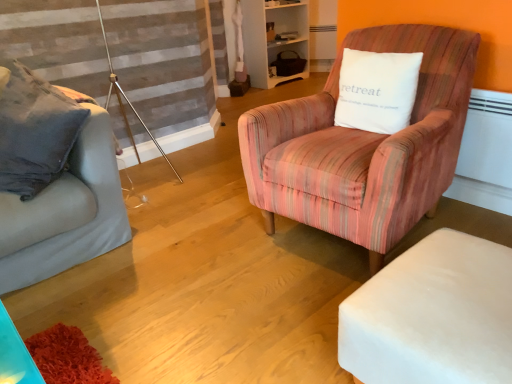
Question: Can you confirm if white wood bookshelf at upper center is shorter than white fabric ottoman at lower right?

Choices:
 (A) no
 (B) yes

Answer: (A)

Question: Does white wood bookshelf at upper center come behind white fabric ottoman at lower right?

Choices:
 (A) no
 (B) yes

Answer: (B)

Question: Is white fabric ottoman at lower right located within white wood bookshelf at upper center?

Choices:
 (A) no
 (B) yes

Answer: (A)

Question: Does white wood bookshelf at upper center have a larger size compared to white fabric ottoman at lower right?

Choices:
 (A) no
 (B) yes

Answer: (B)

Question: Is white wood bookshelf at upper center touching white fabric ottoman at lower right?

Choices:
 (A) no
 (B) yes

Answer: (A)

Question: From their relative heights in the image, would you say white soft cushion at upper right is taller or shorter than white fabric ottoman at lower right?

Choices:
 (A) tall
 (B) short

Answer: (A)

Question: Would you say white soft cushion at upper right is inside or outside white fabric ottoman at lower right?

Choices:
 (A) inside
 (B) outside

Answer: (B)

Question: In the image, is white soft cushion at upper right positioned in front of or behind white fabric ottoman at lower right?

Choices:
 (A) behind
 (B) front

Answer: (A)

Question: Considering the positions of point (367, 54) and point (495, 304), is point (367, 54) closer or farther from the camera than point (495, 304)?

Choices:
 (A) farther
 (B) closer

Answer: (A)

Question: Would you say white wood bookshelf at upper center is inside or outside matte gray couch at left?

Choices:
 (A) inside
 (B) outside

Answer: (B)

Question: Is white wood bookshelf at upper center bigger or smaller than matte gray couch at left?

Choices:
 (A) small
 (B) big

Answer: (B)

Question: From a real-world perspective, is white wood bookshelf at upper center physically located above or below matte gray couch at left?

Choices:
 (A) below
 (B) above

Answer: (A)

Question: Is white wood bookshelf at upper center taller or shorter than matte gray couch at left?

Choices:
 (A) tall
 (B) short

Answer: (A)

Question: Visually, is white soft cushion at upper right positioned to the left or to the right of matte gray couch at left?

Choices:
 (A) left
 (B) right

Answer: (B)

Question: In terms of width, does white soft cushion at upper right look wider or thinner when compared to matte gray couch at left?

Choices:
 (A) thin
 (B) wide

Answer: (A)